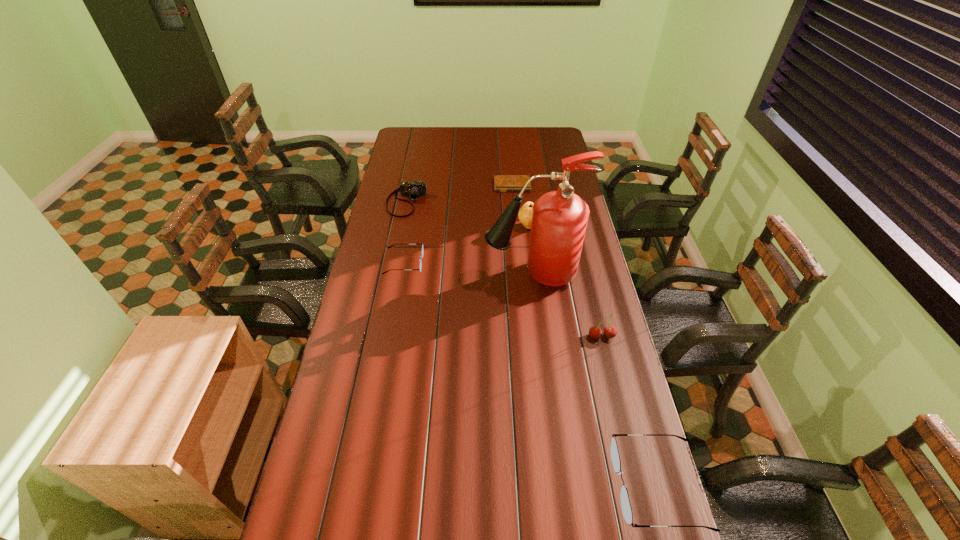
In order to click on the sixth closest object to the pear in this screenshot , I will do `click(615, 457)`.

Image resolution: width=960 pixels, height=540 pixels. What are the coordinates of `blank area in the image that satisfies the following two spatial constraints: 1. on the spine side of the diary; 2. on the lenses of the left spectacles` in the screenshot? It's located at (519, 263).

Where is `vacant area that satisfies the following two spatial constraints: 1. on the front-facing side of the camera; 2. on the right side of the fifth nearest object`? vacant area that satisfies the following two spatial constraints: 1. on the front-facing side of the camera; 2. on the right side of the fifth nearest object is located at coordinates (402, 226).

Locate an element on the screen. free space that satisfies the following two spatial constraints: 1. on the spine side of the diary; 2. on the left side of the third farthest object is located at coordinates (516, 226).

The height and width of the screenshot is (540, 960). What are the coordinates of `blank space that satisfies the following two spatial constraints: 1. on the front side of the pear; 2. with the nozzle aimed from the tallest object` in the screenshot? It's located at (535, 274).